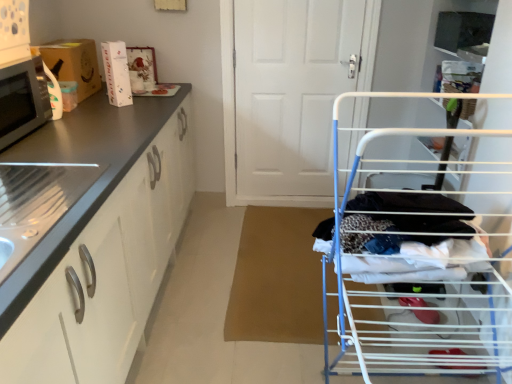
Question: Is white glossy cabinet at left to the left or to the right of white wire drying rack at right in the image?

Choices:
 (A) left
 (B) right

Answer: (A)

Question: Is white glossy cabinet at left wider or thinner than white wire drying rack at right?

Choices:
 (A) thin
 (B) wide

Answer: (B)

Question: Estimate the real-world distances between objects in this image. Which object is farther from the brushed metal drawer at left?

Choices:
 (A) white matte door at center
 (B) white glossy cabinet at left
 (C) white wire drying rack at right
 (D) matte cardboard box at left
 (E) matte black microwave at left

Answer: (A)

Question: Based on their relative distances, which object is farther from the brushed metal drawer at left?

Choices:
 (A) white wire drying rack at right
 (B) matte black microwave at left
 (C) white glossy cabinet at left
 (D) matte cardboard box at left
 (E) white matte door at center

Answer: (E)